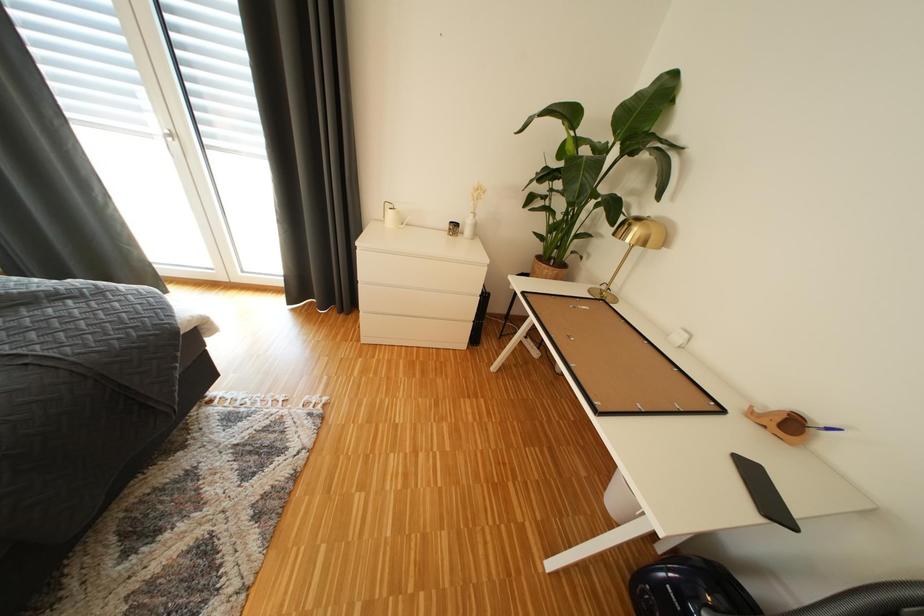
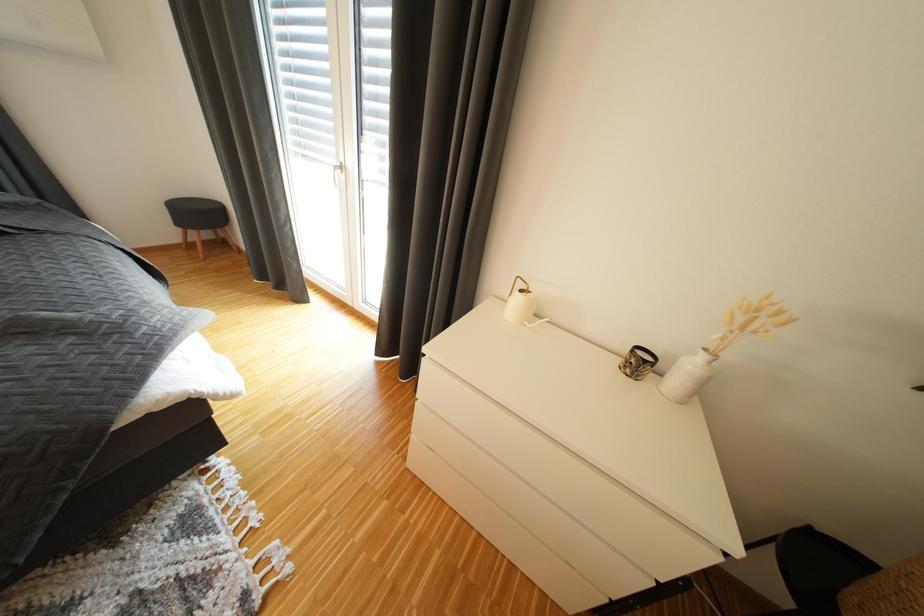
Question: Based on the continuous images, in which direction is the camera rotating? Reply with the corresponding letter.

Choices:
 (A) Left
 (B) Right
 (C) Up
 (D) Down

Answer: (A)